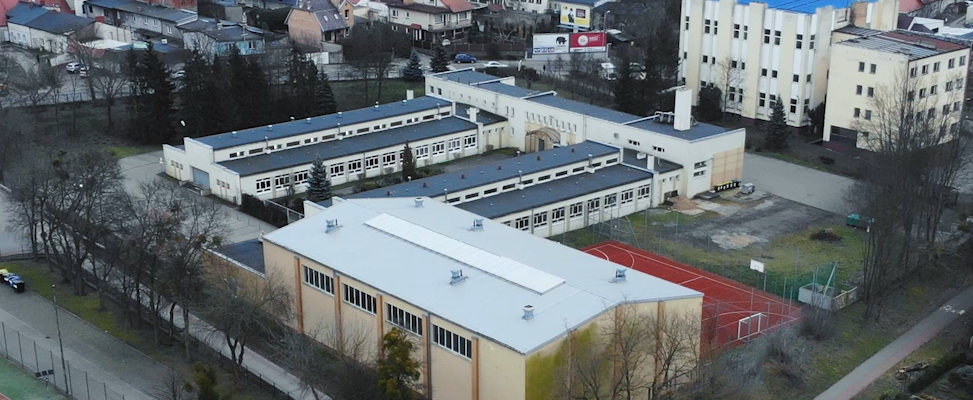
Locate an element on the screen. This screenshot has width=973, height=400. trashcan is located at coordinates (853, 222).